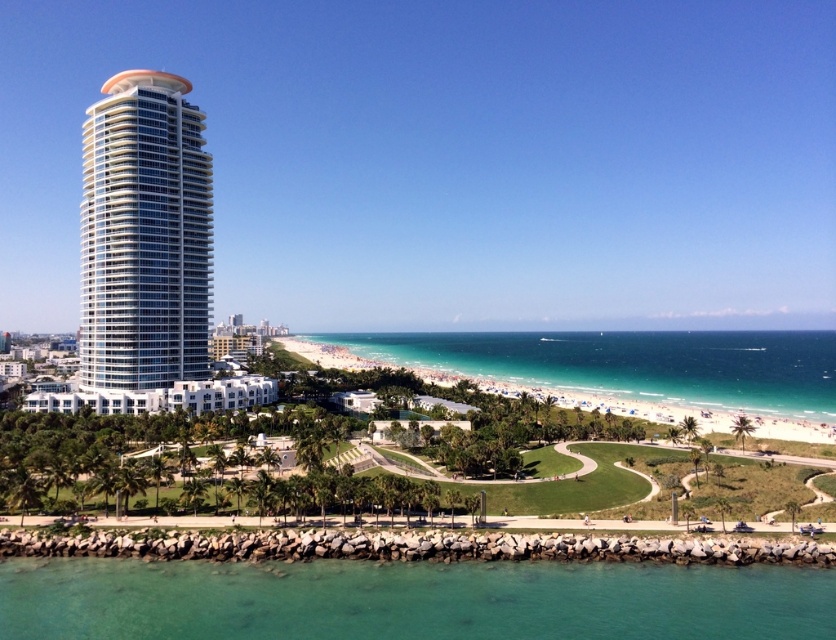
Who is positioned more to the left, white glass tower at left or clear blue water at center?

white glass tower at left is more to the left.

Can you confirm if white glass tower at left is positioned to the left of clear blue water at center?

Correct, you'll find white glass tower at left to the left of clear blue water at center.

Does point (103, 172) come behind point (590, 342)?

No, it is not.

You are a GUI agent. You are given a task and a screenshot of the screen. Output one action in this format:
    pyautogui.click(x=<x>, y=<y>)
    Task: Click on the white glass tower at left
    The height and width of the screenshot is (640, 836).
    Given the screenshot: What is the action you would take?
    pyautogui.click(x=144, y=236)

Is point (370, 609) more distant than point (777, 333)?

No, (370, 609) is in front of (777, 333).

How distant is clear glass water at lower center from clear blue water at center?

clear glass water at lower center and clear blue water at center are 236.16 meters apart from each other.

Measure the distance between clear glass water at lower center and camera.

A distance of 223.78 feet exists between clear glass water at lower center and camera.

The width and height of the screenshot is (836, 640). Find the location of `clear glass water at lower center`. clear glass water at lower center is located at coordinates (410, 600).

Which is above, clear glass water at lower center or white glass tower at left?

white glass tower at left is above.

Is clear glass water at lower center in front of white glass tower at left?

Yes, it is in front of white glass tower at left.

Between point (457, 605) and point (209, 216), which one is positioned behind?

The point (209, 216) is behind.

At what (x,y) coordinates should I click in order to perform the action: click on clear glass water at lower center. Please return your answer as a coordinate pair (x, y). This screenshot has width=836, height=640. Looking at the image, I should click on (410, 600).